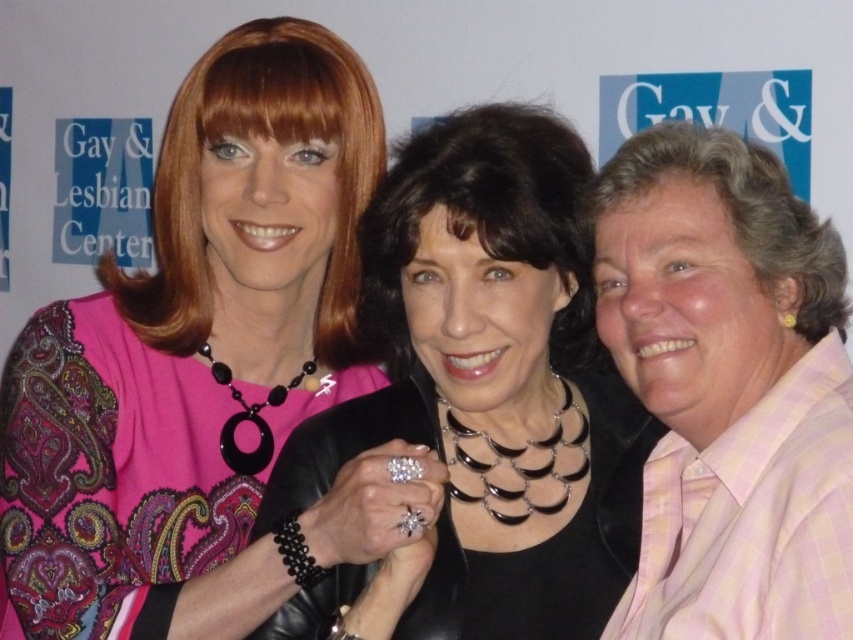
Is point (321, 314) positioned behind point (453, 154)?

Yes.

Does matte pink blouse at upper left have a greater width compared to black leather jacket at center?

Indeed, matte pink blouse at upper left has a greater width compared to black leather jacket at center.

Which is behind, point (287, 253) or point (521, 358)?

The point (287, 253) is behind.

I want to click on matte pink blouse at upper left, so click(x=207, y=365).

Can you confirm if black leather jacket at center is smaller than pink checkered shirt at right?

No, black leather jacket at center is not smaller than pink checkered shirt at right.

Can you confirm if black leather jacket at center is positioned to the left of pink checkered shirt at right?

Correct, you'll find black leather jacket at center to the left of pink checkered shirt at right.

The width and height of the screenshot is (853, 640). What do you see at coordinates (485, 396) in the screenshot?
I see `black leather jacket at center` at bounding box center [485, 396].

Find the location of `black leather jacket at center`. black leather jacket at center is located at coordinates (485, 396).

Where is `matte pink blouse at upper left`? This screenshot has width=853, height=640. matte pink blouse at upper left is located at coordinates (207, 365).

Which is in front, point (195, 365) or point (718, 148)?

Point (718, 148) is in front.

Between point (213, 342) and point (701, 449), which one is positioned in front?

Positioned in front is point (701, 449).

Locate an element on the screen. The width and height of the screenshot is (853, 640). matte pink blouse at upper left is located at coordinates (207, 365).